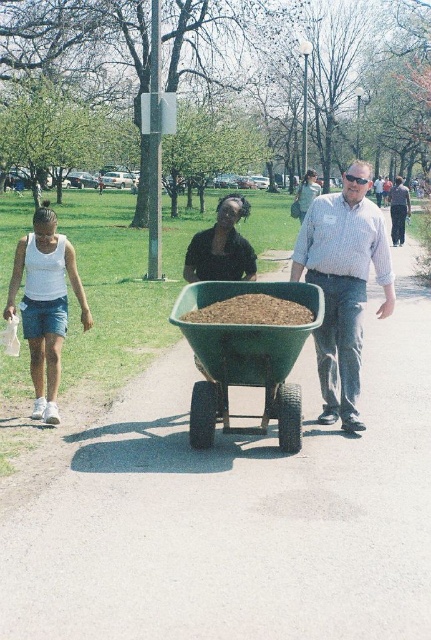
You are a photographer trying to capture a photo of the matte blue shirt at center and the green plastic cart at center. Based on their positions, which object should you focus on first if you want to include both in the frame without moving the camera?

The matte blue shirt at center is positioned on the right side of the green plastic cart at center, so you should focus on the green plastic cart at center first to ensure both are in frame without moving the camera.

You are standing at the point with coordinates point (309, 173) and want to walk to the point with coordinates point (408, 189). Which direction should you move in to reach your destination?

You should move forward because point (408, 189) is behind point (309, 173), meaning it is in the direction you are facing as you look away from the camera.

Based on the photo, you are a photographer trying to capture a candid shot of the two adults in the park scene. You want to ensure both the dark blue jeans at center and the green fabric dress at center are visible in the frame. Based on their positions, which adult should be positioned closer to the left side of your camera viewfinder?

The green fabric dress at center should be positioned closer to the left side of the camera viewfinder because the dark blue jeans at center is to the right of it.